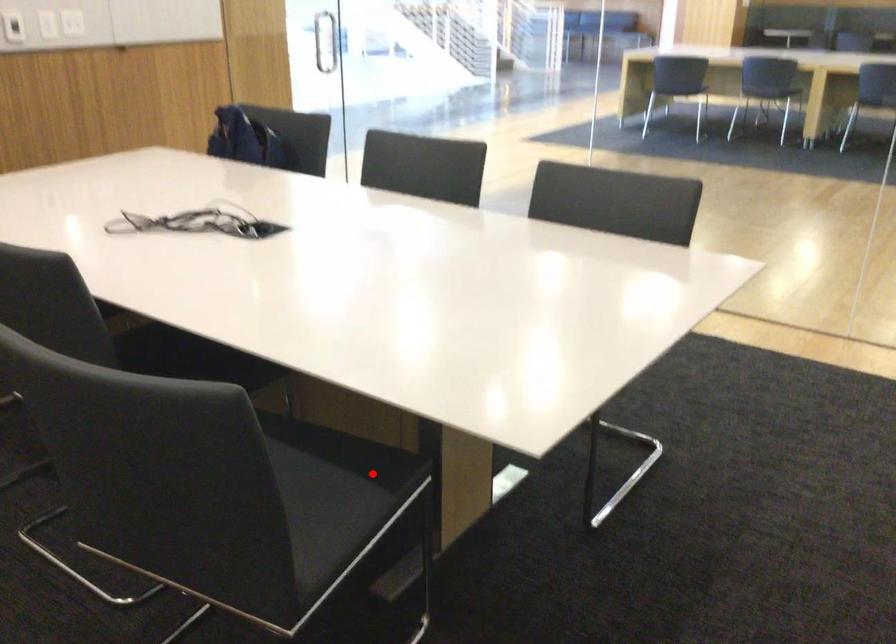
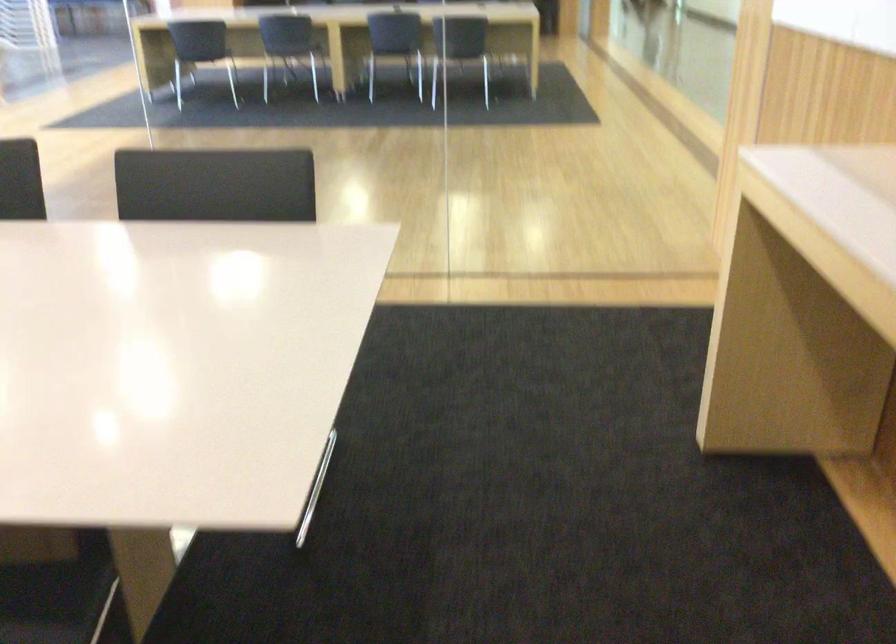
Question: I am providing you with two images of the same scene from different viewpoints. Image1 has a red point marked. In image2, the corresponding 3D location appears at what relative position? Reply with the corresponding letter.

Choices:
 (A) Closer
 (B) Farther

Answer: (A)